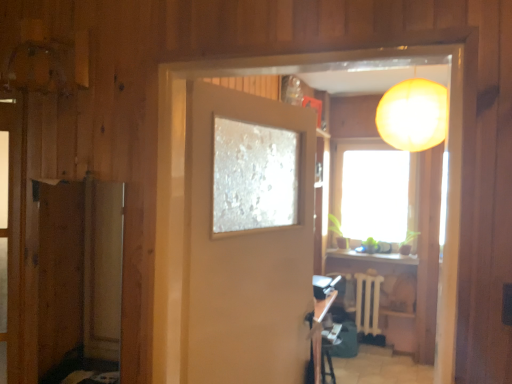
This screenshot has width=512, height=384. I want to click on empty space that is ontop of white plastic radiator at center, so click(370, 272).